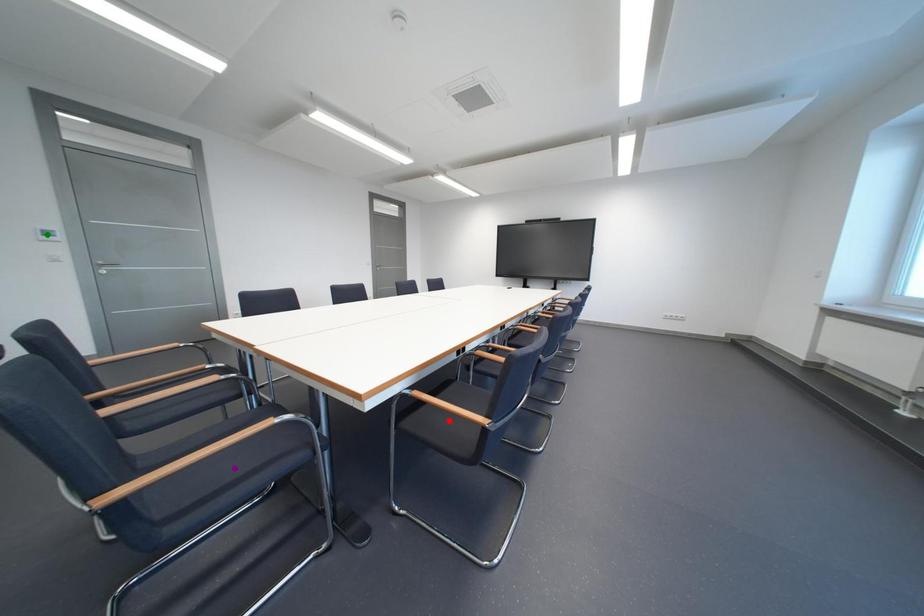
Order these from farthest to nearest:
green point | red point | purple point

green point < red point < purple point